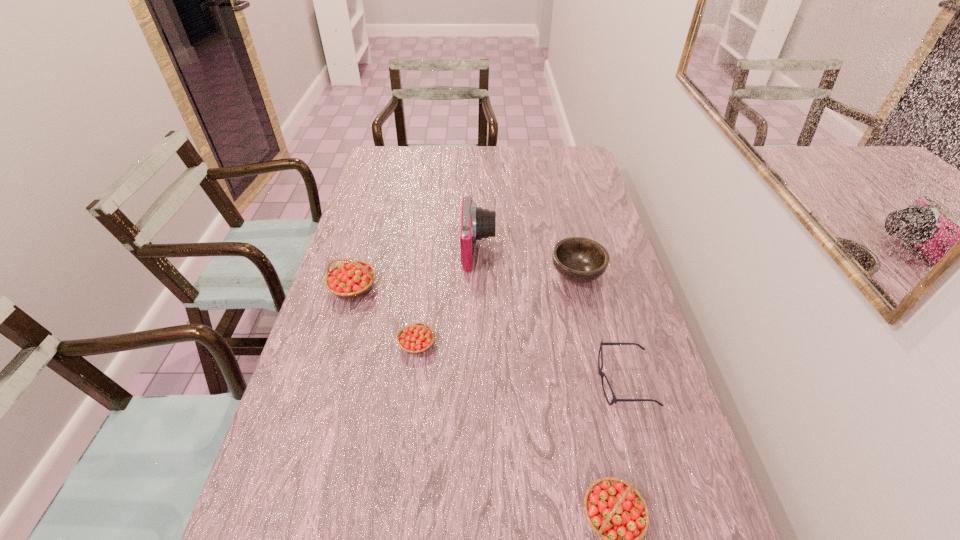
In the image, there is a desktop. Find the location of `free space at the right edge`. free space at the right edge is located at coordinates (614, 403).

In the image, there is a desktop. Where is `free region at the far left corner`? This screenshot has height=540, width=960. free region at the far left corner is located at coordinates (401, 148).

At what (x,y) coordinates should I click in order to perform the action: click on free space at the far right corner of the desktop. Please return your answer as a coordinate pair (x, y). The image size is (960, 540). Looking at the image, I should click on (564, 168).

This screenshot has height=540, width=960. Identify the location of vacant space that's between the shortest object and the third object from left to right. (551, 316).

Locate an element on the screen. free space between the second nearest strawberry and the shortest object is located at coordinates (520, 363).

Image resolution: width=960 pixels, height=540 pixels. Identify the location of empty space between the shortest object and the farthest strawberry. (489, 335).

You are a GUI agent. You are given a task and a screenshot of the screen. Output one action in this format:
    pyautogui.click(x=<x>, y=<y>)
    Task: Click on the free space that is in between the second farthest strawberry and the bowl
    Image resolution: width=960 pixels, height=540 pixels.
    Given the screenshot: What is the action you would take?
    pyautogui.click(x=497, y=309)

Identify the location of free space between the shortest strawberry and the leftmost strawberry. (385, 316).

At what (x,y) coordinates should I click in order to perform the action: click on free spot between the bowl and the fourth object from right to left. Please return your answer as a coordinate pair (x, y). Looking at the image, I should click on [x=528, y=262].

Where is `vacant area that lies between the bowl and the tallest object`? vacant area that lies between the bowl and the tallest object is located at coordinates (528, 262).